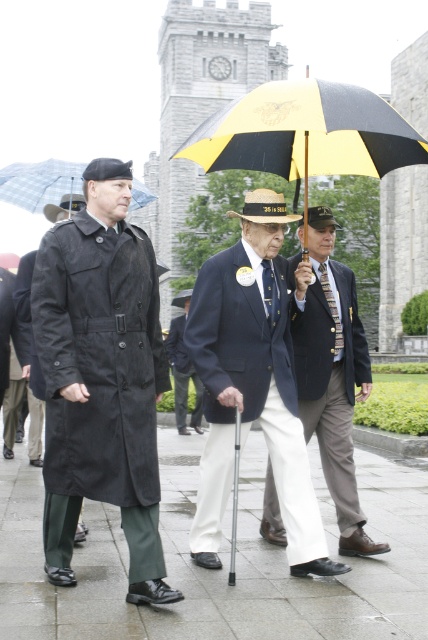
You are standing at the point labeled point (169, 333) and want to move to the point labeled point (130, 573). Which direction should you face to walk towards your destination?

You should face forward because point (130, 573) is in front of point (169, 333).